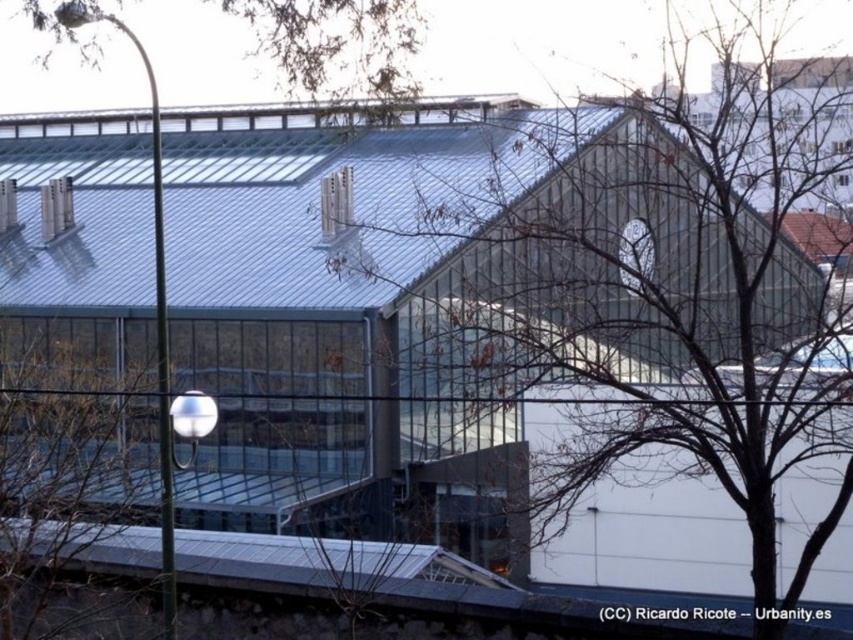
Who is higher up, bare branches at center or brown leafy tree at upper center?

brown leafy tree at upper center is higher up.

Consider the image. How far apart are bare branches at center and brown leafy tree at upper center?

A distance of 5.45 meters exists between bare branches at center and brown leafy tree at upper center.

What do you see at coordinates (685, 344) in the screenshot?
I see `bare branches at center` at bounding box center [685, 344].

The image size is (853, 640). Identify the location of bare branches at center. coord(685,344).

Does bare branches at center have a lesser width compared to green leafy tree at left?

No.

Which of these two, bare branches at center or green leafy tree at left, stands taller?

Standing taller between the two is bare branches at center.

At what (x,y) coordinates should I click in order to perform the action: click on bare branches at center. Please return your answer as a coordinate pair (x, y). The image size is (853, 640). Looking at the image, I should click on (685, 344).

Is green leafy tree at left shorter than transparent glass window at upper center?

Incorrect, green leafy tree at left's height does not fall short of transparent glass window at upper center's.

Can you confirm if green leafy tree at left is positioned above transparent glass window at upper center?

Actually, green leafy tree at left is below transparent glass window at upper center.

The width and height of the screenshot is (853, 640). Identify the location of green leafy tree at left. (51, 451).